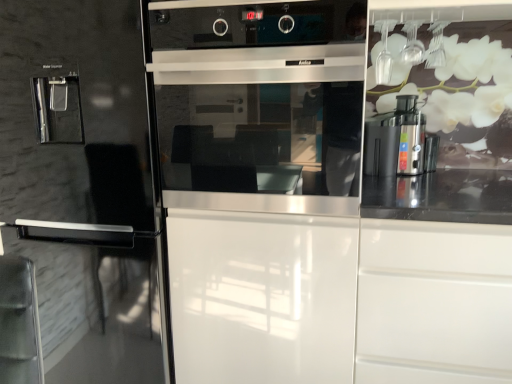
Question: Is glossy black fridge at left smaller than satin silver coffee machine at right?

Choices:
 (A) no
 (B) yes

Answer: (A)

Question: Considering the relative positions of glossy black fridge at left and satin silver coffee machine at right in the image provided, is glossy black fridge at left to the right of satin silver coffee machine at right from the viewer's perspective?

Choices:
 (A) yes
 (B) no

Answer: (B)

Question: From a real-world perspective, is glossy black fridge at left on satin silver coffee machine at right?

Choices:
 (A) yes
 (B) no

Answer: (B)

Question: Is glossy black fridge at left bigger than satin silver coffee machine at right?

Choices:
 (A) no
 (B) yes

Answer: (B)

Question: Considering the relative sizes of glossy black fridge at left and satin silver coffee machine at right in the image provided, is glossy black fridge at left taller than satin silver coffee machine at right?

Choices:
 (A) no
 (B) yes

Answer: (B)

Question: Is glossy black fridge at left oriented towards satin silver coffee machine at right?

Choices:
 (A) yes
 (B) no

Answer: (B)

Question: Is white glossy drawer at right facing away from glossy black fridge at left?

Choices:
 (A) yes
 (B) no

Answer: (B)

Question: Is the depth of white glossy drawer at right greater than that of glossy black fridge at left?

Choices:
 (A) yes
 (B) no

Answer: (B)

Question: Does white glossy drawer at right have a smaller size compared to glossy black fridge at left?

Choices:
 (A) no
 (B) yes

Answer: (B)

Question: Considering the relative sizes of white glossy drawer at right and glossy black fridge at left in the image provided, is white glossy drawer at right wider than glossy black fridge at left?

Choices:
 (A) no
 (B) yes

Answer: (A)

Question: From a real-world perspective, is white glossy drawer at right on top of glossy black fridge at left?

Choices:
 (A) yes
 (B) no

Answer: (B)

Question: From a real-world perspective, is white glossy drawer at right beneath glossy black fridge at left?

Choices:
 (A) no
 (B) yes

Answer: (B)

Question: From the image's perspective, is satin silver coffee machine at right over white glossy drawer at right?

Choices:
 (A) yes
 (B) no

Answer: (A)